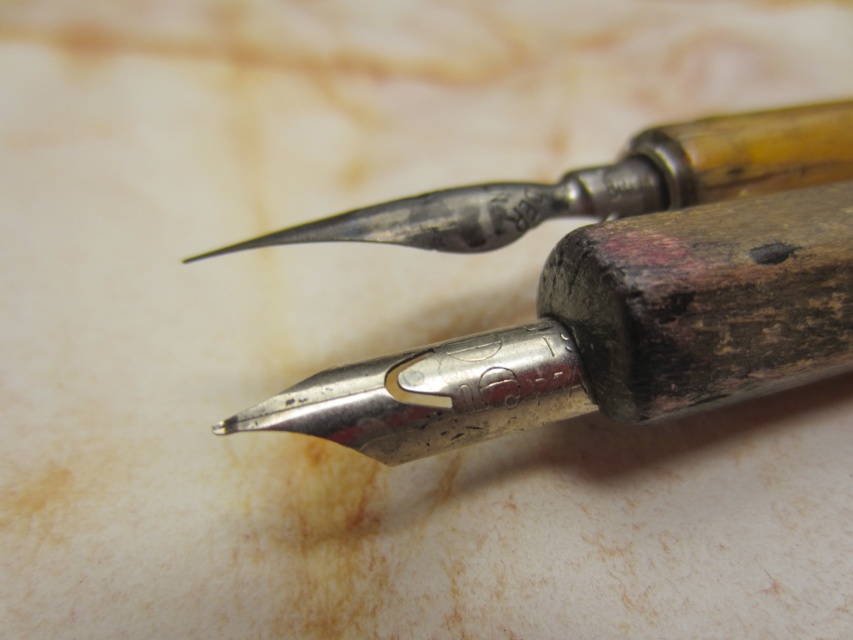
You are an artist preparing to sketch the two pens in the image. You notice the polished metal pen at center and the polished silver pen at center. Which pen is located lower in the arrangement?

The polished metal pen at center is positioned under the polished silver pen at center, so it is lower in the arrangement.

You are trying to determine the location of the point marked at coordinates [612,332] in the image. Based on the scene description, can you identify which object this point belongs to?

The point at coordinates [612,332] is located on the polished metal pen at center.